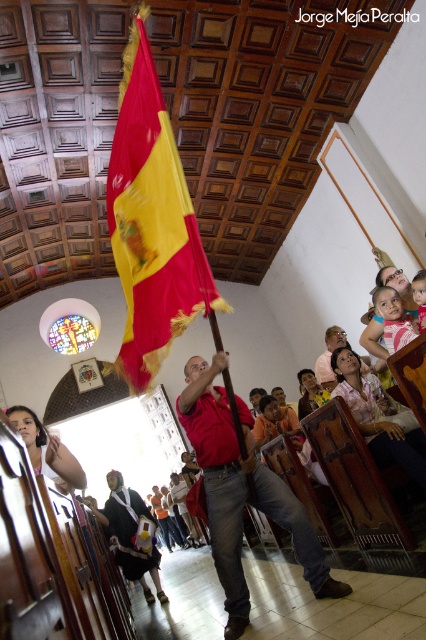
You are standing at the entrance of the church and see two points marked in the image. The first point is at coordinates point (348, 586) and the second is at point (146, 588). Which point is closer to you?

Point (348, 586) is in front of point (146, 588), so it is closer to you.